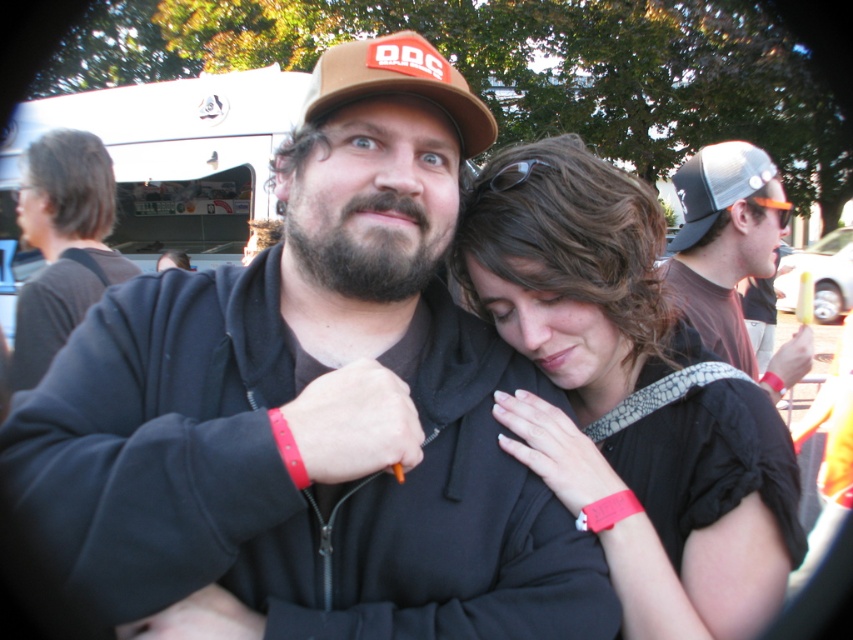
Does dark brown thick beard at center appear over brown fabric baseball cap at upper center?

No, dark brown thick beard at center is not above brown fabric baseball cap at upper center.

Is point (438, 260) less distant than point (392, 86)?

No, it is not.

You are a GUI agent. You are given a task and a screenshot of the screen. Output one action in this format:
    pyautogui.click(x=<x>, y=<y>)
    Task: Click on the dark brown thick beard at center
    
    Given the screenshot: What is the action you would take?
    [x=364, y=243]

Does matte black shirt at center have a lesser height compared to gray mesh cap at upper right?

Incorrect, matte black shirt at center's height does not fall short of gray mesh cap at upper right's.

Who is shorter, matte black shirt at center or gray mesh cap at upper right?

gray mesh cap at upper right

What do you see at coordinates (630, 396) in the screenshot? I see `matte black shirt at center` at bounding box center [630, 396].

In order to click on matte black shirt at center in this screenshot , I will do `click(630, 396)`.

Who is lower down, matte black hoodie at left or black mesh baseball cap at upper right?

Positioned lower is matte black hoodie at left.

Which is behind, point (84, 232) or point (728, 196)?

Point (84, 232)

Does point (53, 253) come behind point (730, 204)?

Yes, it is behind point (730, 204).

This screenshot has height=640, width=853. Find the location of `matte black hoodie at left`. matte black hoodie at left is located at coordinates pos(62,244).